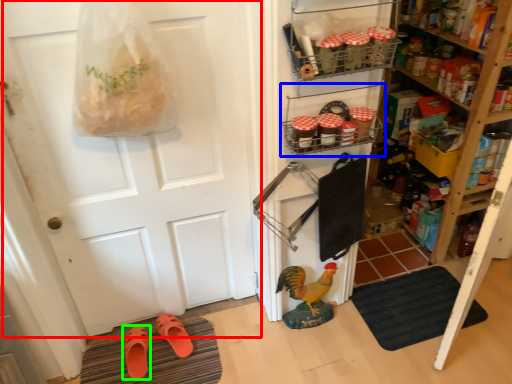
Question: Which is farther away from door (highlighted by a red box)? shelf (highlighted by a blue box) or footwear (highlighted by a green box)?

Choices:
 (A) shelf
 (B) footwear

Answer: (B)